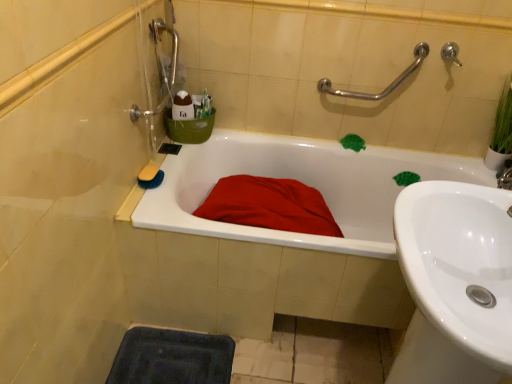
I want to click on vacant area that lies in front of yellow sponge at upper left, so click(146, 202).